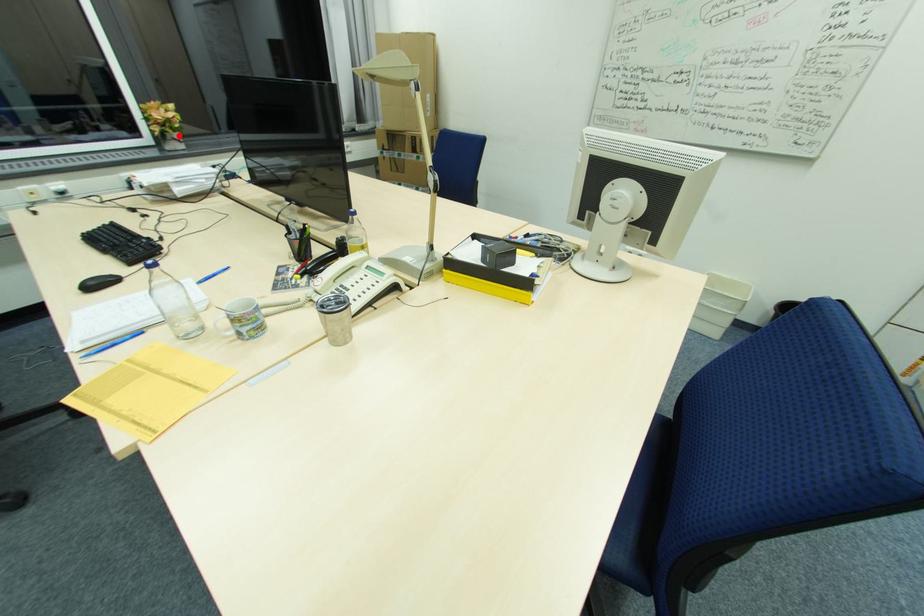
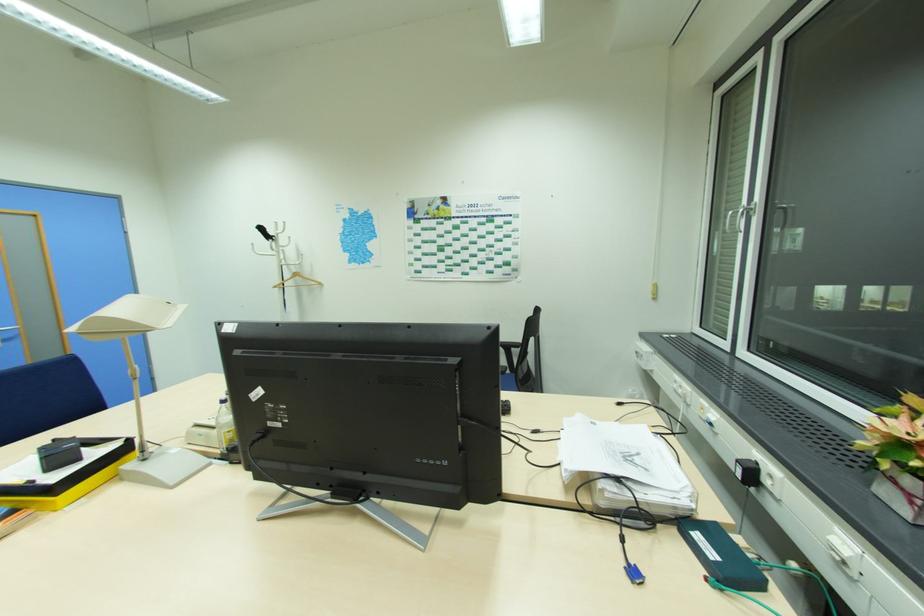
Question: I am providing you with two images of the same scene from different viewpoints. A red point is shown in image1. For the corresponding object point in image2, is it positioned nearer or farther from the camera?

Choices:
 (A) Nearer
 (B) Farther

Answer: (A)